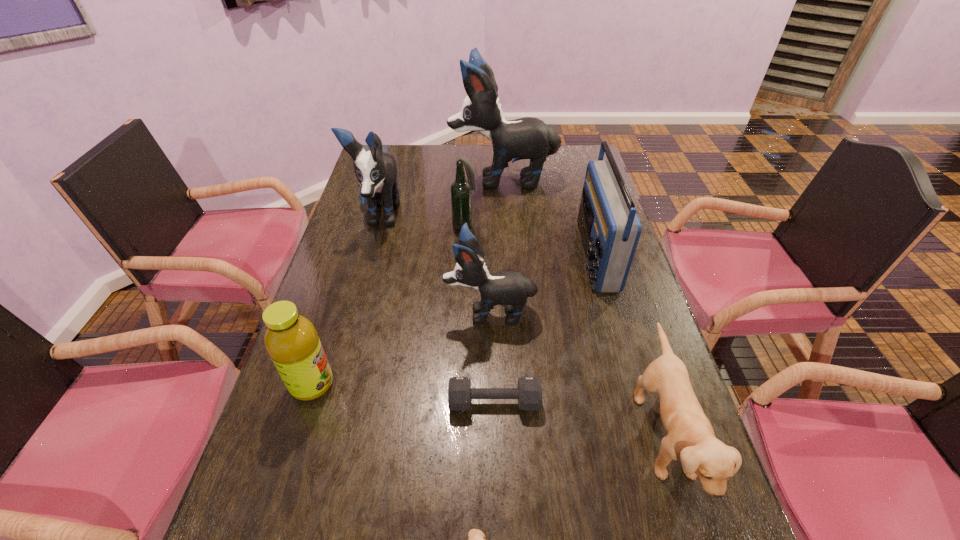
Where is `vacant region that satisfies the following two spatial constraints: 1. on the front-facing side of the second biggest black puppy; 2. on the front label of the fruit juice`? The image size is (960, 540). vacant region that satisfies the following two spatial constraints: 1. on the front-facing side of the second biggest black puppy; 2. on the front label of the fruit juice is located at coordinates (332, 384).

I want to click on blank area in the image that satisfies the following two spatial constraints: 1. on the front-facing side of the second tallest object; 2. on the right side of the beer bottle, so click(x=376, y=225).

Locate an element on the screen. The width and height of the screenshot is (960, 540). free point that satisfies the following two spatial constraints: 1. on the front-facing side of the leftmost puppy; 2. on the left side of the beer bottle is located at coordinates (376, 225).

Image resolution: width=960 pixels, height=540 pixels. I want to click on free location that satisfies the following two spatial constraints: 1. on the back side of the dumbbell; 2. on the front-facing side of the nearest black puppy, so click(x=492, y=312).